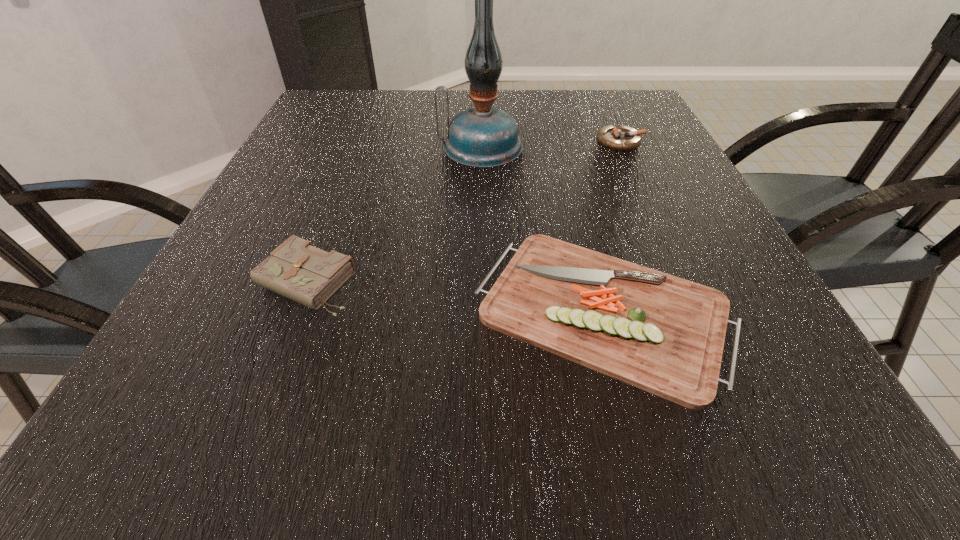
At what (x,y) coordinates should I click in order to perform the action: click on object that is at the left edge. Please return your answer as a coordinate pair (x, y). The image size is (960, 540). Looking at the image, I should click on (296, 269).

The width and height of the screenshot is (960, 540). Identify the location of ashtray positioned at the right edge. (620, 138).

Identify the location of chopping board located at the right edge. This screenshot has height=540, width=960. (663, 334).

This screenshot has height=540, width=960. Find the location of `object positioned at the near right corner`. object positioned at the near right corner is located at coordinates (663, 334).

Find the location of a particular element. vacant space at the far edge of the desktop is located at coordinates (443, 112).

The height and width of the screenshot is (540, 960). Identify the location of vacant point at the left edge. (228, 301).

Find the location of a particular element. vacant region at the right edge of the desktop is located at coordinates (648, 193).

The image size is (960, 540). I want to click on vacant space at the far left corner of the desktop, so click(347, 113).

In the image, there is a desktop. Where is `vacant space at the far right corner`? This screenshot has height=540, width=960. vacant space at the far right corner is located at coordinates click(x=650, y=113).

Image resolution: width=960 pixels, height=540 pixels. What are the coordinates of `vacant space that is in between the ashtray and the oil lamp` in the screenshot? It's located at (550, 144).